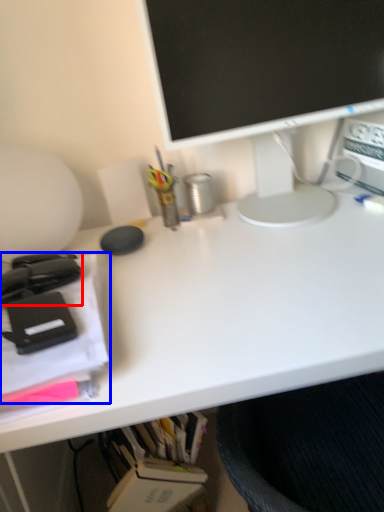
Question: Which object appears farthest to the camera in this image, office supplies (highlighted by a red box) or office supplies (highlighted by a blue box)?

Choices:
 (A) office supplies
 (B) office supplies

Answer: (A)